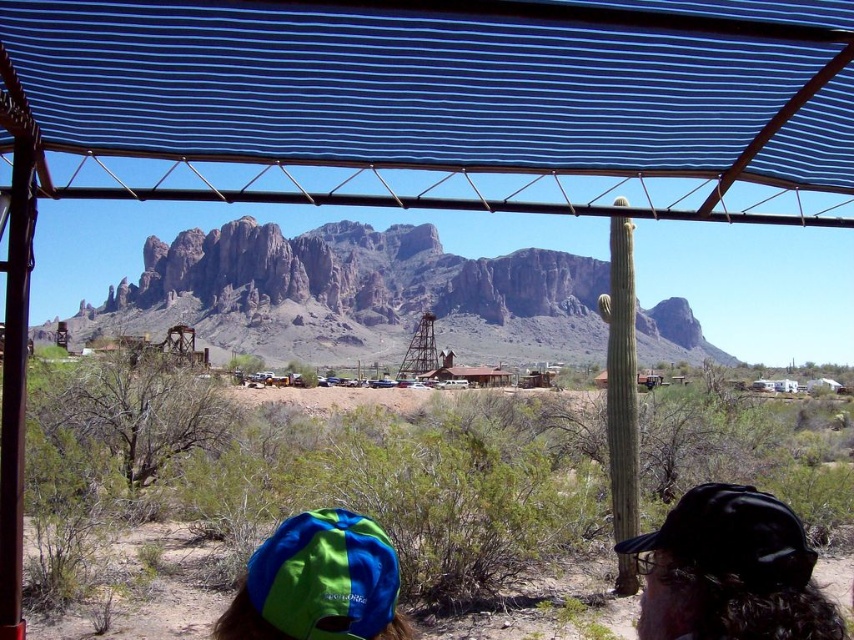
Question: Is blue striped canopy at upper center positioned at the back of black matte baseball cap at lower right?

Choices:
 (A) no
 (B) yes

Answer: (B)

Question: From the image, what is the correct spatial relationship of blue striped canopy at upper center in relation to rugged rock mountain at center?

Choices:
 (A) right
 (B) left

Answer: (A)

Question: Does green fabric baseball hat at lower left come behind black matte baseball cap at lower right?

Choices:
 (A) yes
 (B) no

Answer: (A)

Question: Which object appears closest to the camera in this image?

Choices:
 (A) rugged rock mountain at center
 (B) black matte baseball cap at lower right
 (C) blue striped canopy at upper center
 (D) green fabric baseball hat at lower left

Answer: (B)

Question: Which object is closer to the camera taking this photo?

Choices:
 (A) rugged rock mountain at center
 (B) green fabric baseball hat at lower left

Answer: (B)

Question: Which of the following is the closest to the observer?

Choices:
 (A) black matte baseball cap at lower right
 (B) blue striped canopy at upper center

Answer: (A)